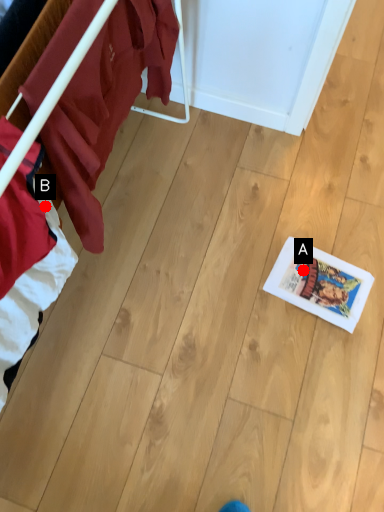
Question: Two points are circled on the image, labeled by A and B beside each circle. Which point appears closest to the camera in this image?

Choices:
 (A) A is closer
 (B) B is closer

Answer: (B)